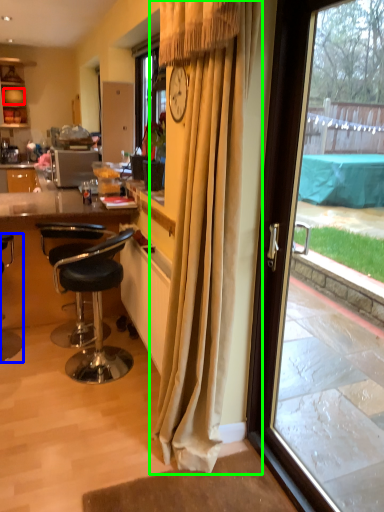
Question: Estimate the real-world distances between objects in this image. Which object is farther from plate (highlighted by a red box), chair (highlighted by a blue box) or curtain (highlighted by a green box)?

Choices:
 (A) chair
 (B) curtain

Answer: (B)